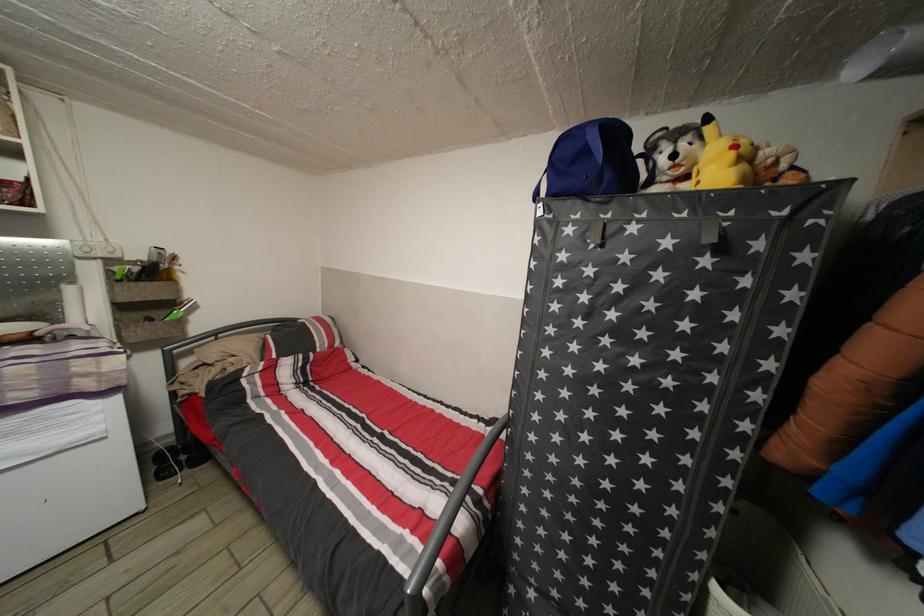
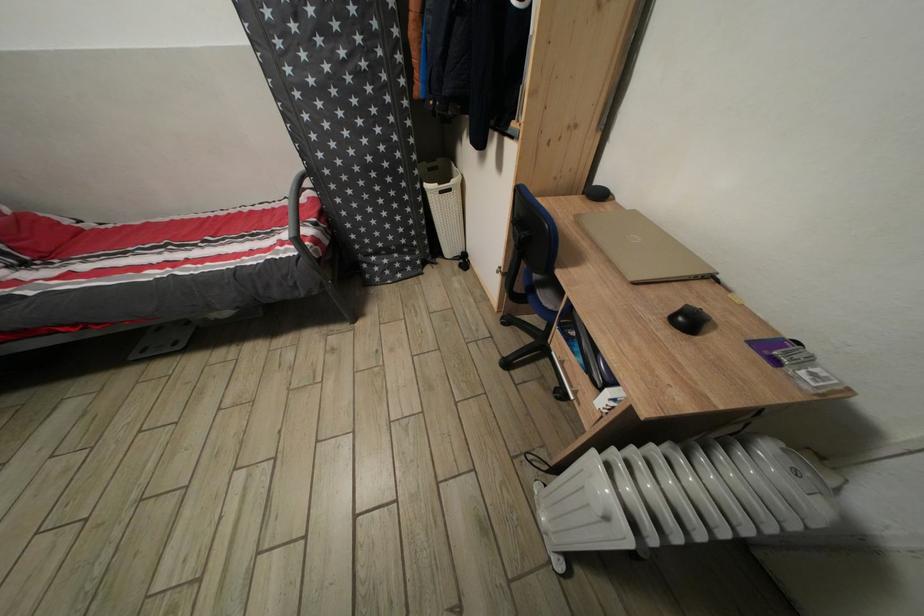
In the second image, find the point that corresponds to point 554,501 in the first image.

(357, 198)